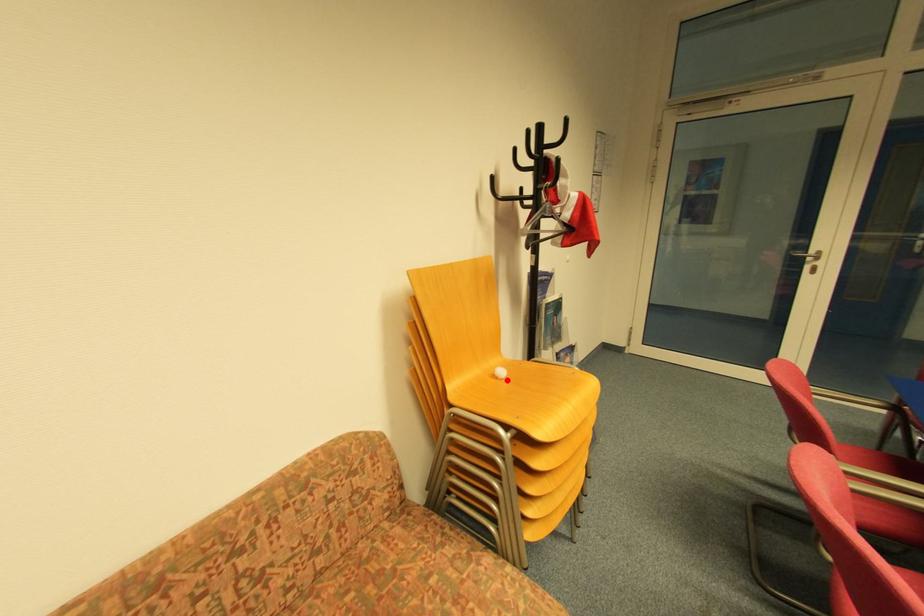
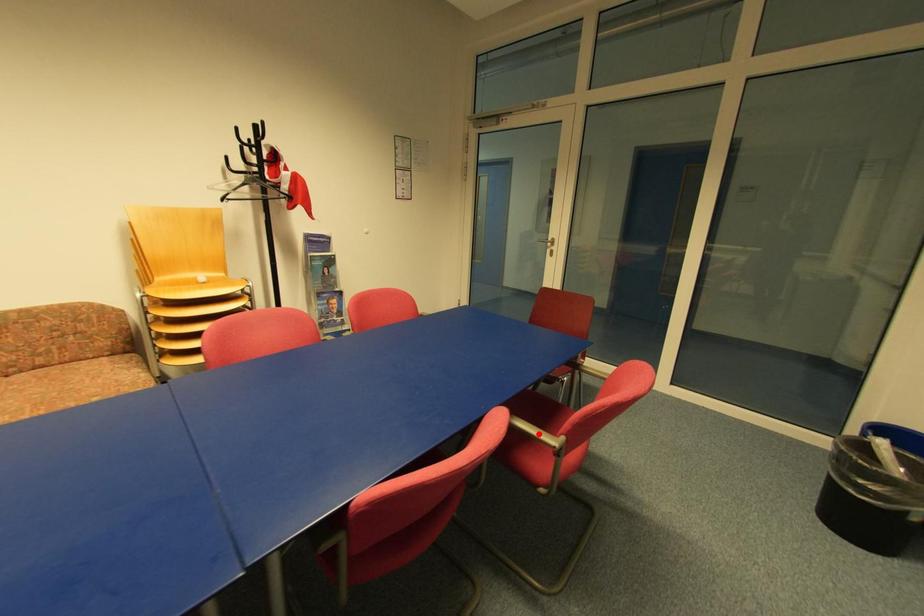
I am providing you with two images of the same scene from different viewpoints. A red point is marked on the first image and another point is marked on the second image. Is the red point in image1 aligned with the point shown in image2?

No